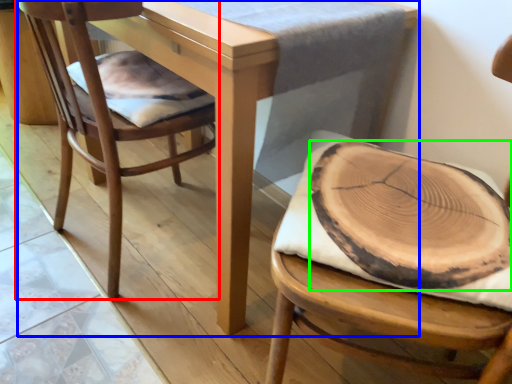
Question: Which is farther away from chair (highlighted by a red box)? table (highlighted by a blue box) or food (highlighted by a green box)?

Choices:
 (A) table
 (B) food

Answer: (B)